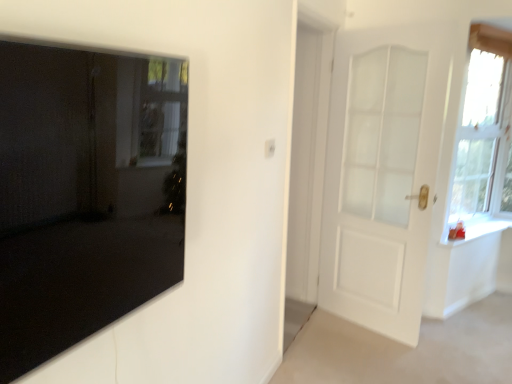
Find the location of `white matte door at right, which is the second door in front-to-back order`. white matte door at right, which is the second door in front-to-back order is located at coordinates (382, 174).

The height and width of the screenshot is (384, 512). In order to click on white glossy window sill at right in this screenshot , I will do `click(477, 230)`.

The height and width of the screenshot is (384, 512). Identify the location of white frosted glass window at upper right. coord(480,135).

The image size is (512, 384). I want to click on matte black mirror at left, which is the first door in left-to-right order, so click(x=85, y=193).

From the image's perspective, starting from the white glossy window sill at right, which door is the 1st one above? Please provide its 2D coordinates.

[(85, 193)]

From the picture: Would you say matte black mirror at left, which is counted as the 2th door, starting from the back, is outside white glossy window sill at right?

Absolutely, matte black mirror at left, which is counted as the 2th door, starting from the back, is external to white glossy window sill at right.

This screenshot has height=384, width=512. In order to click on window sill behind the matte black mirror at left, placed as the 1th door when sorted from front to back in this screenshot , I will do `click(477, 230)`.

Is white glossy window sill at right aimed at matte black mirror at left, which is counted as the 2th door, starting from the back?

No.

Which of these two, white glossy window sill at right or matte black mirror at left, which ranks as the 2th door in right-to-left order, is bigger?

Bigger between the two is matte black mirror at left, which ranks as the 2th door in right-to-left order.

Considering the points (480, 218) and (170, 112), which point is behind, point (480, 218) or point (170, 112)?

The point (480, 218) is more distant.

From a real-world perspective, who is located higher, white glossy window sill at right or white frosted glass window at upper right?

In real-world perspective, white frosted glass window at upper right is above.

Locate an element on the screen. The image size is (512, 384). window sill below the white frosted glass window at upper right (from a real-world perspective) is located at coordinates (477, 230).

Considering the relative sizes of white glossy window sill at right and white frosted glass window at upper right in the image provided, is white glossy window sill at right bigger than white frosted glass window at upper right?

No.

Relative to white frosted glass window at upper right, is white glossy window sill at right in front or behind?

white glossy window sill at right is behind white frosted glass window at upper right.

Does point (477, 40) come in front of point (409, 96)?

That is True.

Between white frosted glass window at upper right and white matte door at right, the first door in the back-to-front sequence, which one has larger size?

white matte door at right, the first door in the back-to-front sequence, is bigger.

Is white frosted glass window at upper right in contact with white matte door at right, the first door in the back-to-front sequence?

white frosted glass window at upper right and white matte door at right, the first door in the back-to-front sequence, are not in contact.

Is matte black mirror at left, which ranks as the 2th door in right-to-left order, at the back of white frosted glass window at upper right?

white frosted glass window at upper right does not have its back to matte black mirror at left, which ranks as the 2th door in right-to-left order.

Who is more distant, white frosted glass window at upper right or matte black mirror at left, which is counted as the 2th door, starting from the back?

white frosted glass window at upper right is further away from the camera.

From the image's perspective, is white frosted glass window at upper right located above matte black mirror at left, placed as the 1th door when sorted from front to back?

Yes, from the image's perspective, white frosted glass window at upper right is on top of matte black mirror at left, placed as the 1th door when sorted from front to back.

From the picture: Does white frosted glass window at upper right have a lesser width compared to matte black mirror at left, which is the first door in left-to-right order?

Incorrect, the width of white frosted glass window at upper right is not less than that of matte black mirror at left, which is the first door in left-to-right order.

Which object is positioned more to the left, matte black mirror at left, which is the first door in left-to-right order, or white matte door at right, the first door in the back-to-front sequence?

matte black mirror at left, which is the first door in left-to-right order.

Is matte black mirror at left, which is counted as the 2th door, starting from the back, smaller than white matte door at right, which is the second door in front-to-back order?

Yes.

Where is `door that appears above the matte black mirror at left, which ranks as the 2th door in right-to-left order (from the image's perspective)`? door that appears above the matte black mirror at left, which ranks as the 2th door in right-to-left order (from the image's perspective) is located at coordinates (382, 174).

From the picture: Relative to white matte door at right, the 2th door positioned from the left, is matte black mirror at left, placed as the 1th door when sorted from front to back, in front or behind?

matte black mirror at left, placed as the 1th door when sorted from front to back, is in front of white matte door at right, the 2th door positioned from the left.

Which of these two, white matte door at right, the 2th door positioned from the left, or white glossy window sill at right, is thinner?

white matte door at right, the 2th door positioned from the left, is thinner.

Visually, is white matte door at right, the first door in the back-to-front sequence, positioned to the left or to the right of white glossy window sill at right?

Based on their positions, white matte door at right, the first door in the back-to-front sequence, is located to the left of white glossy window sill at right.

Between white matte door at right, the 2th door positioned from the left, and white glossy window sill at right, which one is positioned behind?

white glossy window sill at right is more distant.

Could you tell me if white matte door at right, which is the first door from right to left, is facing white glossy window sill at right?

No.

Find the location of a particular element. window sill that appears on the right of matte black mirror at left, which is the first door in left-to-right order is located at coordinates (477, 230).

Which door is the 2nd one when counting from the front of the white glossy window sill at right? Please provide its 2D coordinates.

[(85, 193)]

Based on their spatial positions, is white glossy window sill at right or matte black mirror at left, placed as the 1th door when sorted from front to back, further from white matte door at right, the first door in the back-to-front sequence?

matte black mirror at left, placed as the 1th door when sorted from front to back, is further to white matte door at right, the first door in the back-to-front sequence.

Estimate the real-world distances between objects in this image. Which object is further from white glossy window sill at right, matte black mirror at left, placed as the 1th door when sorted from front to back, or white matte door at right, which is the first door from right to left?

Based on the image, matte black mirror at left, placed as the 1th door when sorted from front to back, appears to be further to white glossy window sill at right.

Looking at the image, which one is located closer to matte black mirror at left, which ranks as the 2th door in right-to-left order, white matte door at right, which is the first door from right to left, or white glossy window sill at right?

The object closer to matte black mirror at left, which ranks as the 2th door in right-to-left order, is white matte door at right, which is the first door from right to left.

Looking at the image, which one is located closer to white matte door at right, which is the second door in front-to-back order, white glossy window sill at right or white frosted glass window at upper right?

white frosted glass window at upper right is positioned closer to the anchor white matte door at right, which is the second door in front-to-back order.

Which object lies nearer to the anchor point white matte door at right, the first door in the back-to-front sequence, white frosted glass window at upper right or white glossy window sill at right?

Based on the image, white frosted glass window at upper right appears to be nearer to white matte door at right, the first door in the back-to-front sequence.

From the image, which object appears to be nearer to matte black mirror at left, which ranks as the 2th door in right-to-left order, white frosted glass window at upper right or white glossy window sill at right?

white frosted glass window at upper right lies closer to matte black mirror at left, which ranks as the 2th door in right-to-left order, than the other object.

Which object lies nearer to the anchor point white matte door at right, the first door in the back-to-front sequence, matte black mirror at left, placed as the 1th door when sorted from front to back, or white frosted glass window at upper right?

Based on the image, white frosted glass window at upper right appears to be nearer to white matte door at right, the first door in the back-to-front sequence.

From the image, which object appears to be farther from white frosted glass window at upper right, matte black mirror at left, which is counted as the 2th door, starting from the back, or white glossy window sill at right?

matte black mirror at left, which is counted as the 2th door, starting from the back.

Identify the location of door positioned between matte black mirror at left, which is the first door in left-to-right order, and white glossy window sill at right from near to far. (382, 174).

The height and width of the screenshot is (384, 512). I want to click on window sill between white matte door at right, the 2th door positioned from the left, and white frosted glass window at upper right from left to right, so click(477, 230).

Where is `door between matte black mirror at left, which is counted as the 2th door, starting from the back, and white frosted glass window at upper right, along the z-axis`? This screenshot has width=512, height=384. door between matte black mirror at left, which is counted as the 2th door, starting from the back, and white frosted glass window at upper right, along the z-axis is located at coordinates (382, 174).

Where is `window positioned between matte black mirror at left, which is the first door in left-to-right order, and white glossy window sill at right from near to far`? The width and height of the screenshot is (512, 384). window positioned between matte black mirror at left, which is the first door in left-to-right order, and white glossy window sill at right from near to far is located at coordinates point(480,135).